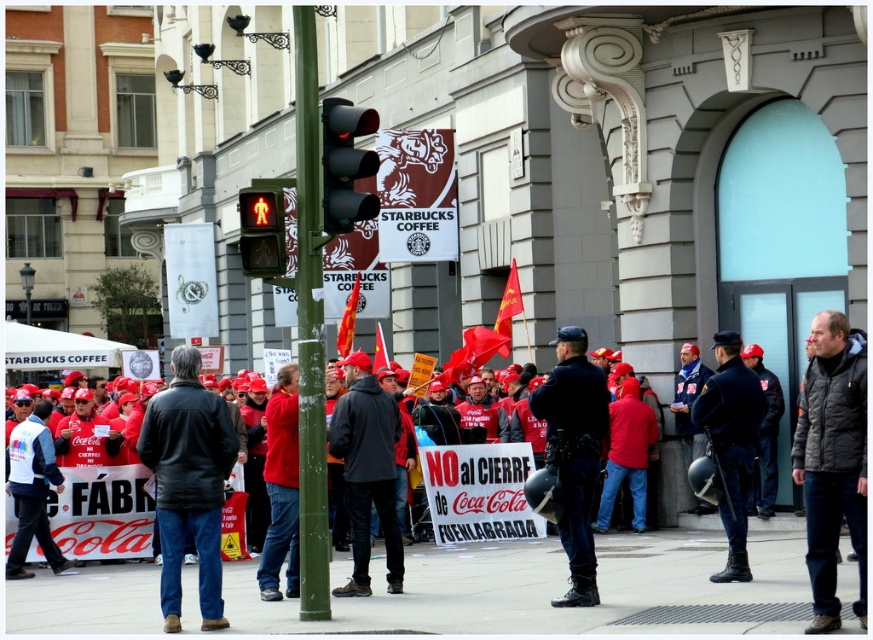
You are a photographer at the protest and want to capture both the red fabric jacket at center and the black leather jacket at center in a single frame. Which jacket should you position to the left side of your camera frame to include both?

The black leather jacket at center should be positioned to the left side of your camera frame because the red fabric jacket at center is to the right of the black leather jacket at center in the scene.

You are a photographer standing at the front of the crowd. You want to take a photo that includes both the green textured pole at center and the dark blue uniform at center. Which object should you position closer to the camera to ensure both are fully visible in the frame?

The green textured pole at center is above the dark blue uniform at center. To ensure both are fully visible, position the dark blue uniform at center closer to the camera so that the pole doesn